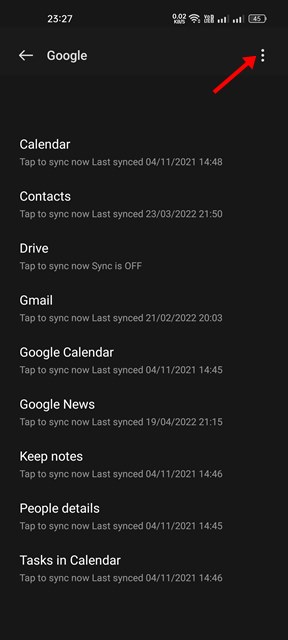
What are the coordinates of `service bars` in the screenshot? It's located at (236, 19), (222, 20).